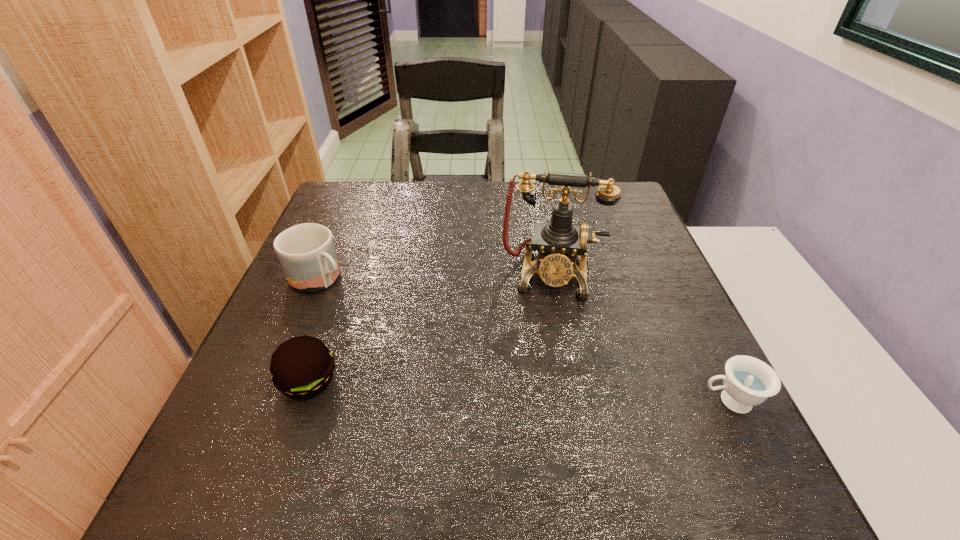
Locate an element on the screen. The height and width of the screenshot is (540, 960). vacant region located on the front of the tallest object, featuring the rotary dial is located at coordinates (546, 320).

Where is `free space located 0.170m on the front of the tallest object, featuring the rotary dial`? The image size is (960, 540). free space located 0.170m on the front of the tallest object, featuring the rotary dial is located at coordinates (543, 364).

I want to click on free region located 0.210m on the front of the tallest object, featuring the rotary dial, so click(541, 381).

Where is `vacant space positioned 0.190m on the side with the handle of the mug`? vacant space positioned 0.190m on the side with the handle of the mug is located at coordinates (x=397, y=328).

Find the location of `blank space located on the side with the handle of the mug`. blank space located on the side with the handle of the mug is located at coordinates (378, 315).

Locate an element on the screen. free space located 0.140m on the side with the handle of the mug is located at coordinates (381, 318).

Locate an element on the screen. The width and height of the screenshot is (960, 540). patty at the near edge is located at coordinates (302, 367).

The width and height of the screenshot is (960, 540). I want to click on teacup that is at the near edge, so point(748,381).

You are a GUI agent. You are given a task and a screenshot of the screen. Output one action in this format:
    pyautogui.click(x=<x>, y=<y>)
    Task: Click on the patty located in the left edge section of the desktop
    Image resolution: width=960 pixels, height=540 pixels.
    Given the screenshot: What is the action you would take?
    pyautogui.click(x=302, y=367)

Image resolution: width=960 pixels, height=540 pixels. What are the coordinates of `mug at the left edge` in the screenshot? It's located at (306, 252).